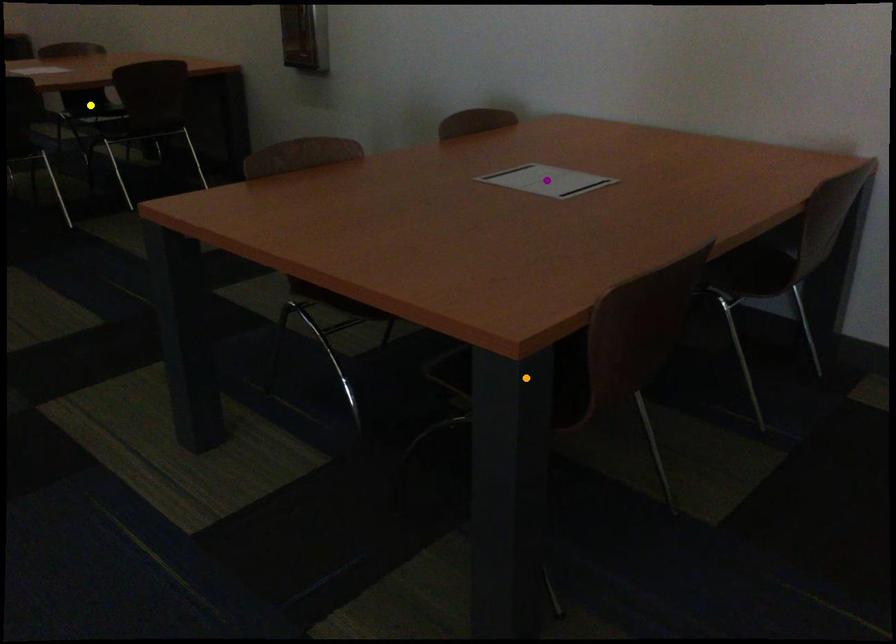
Order these from nearest to farthest:
orange point | purple point | yellow point

orange point
purple point
yellow point